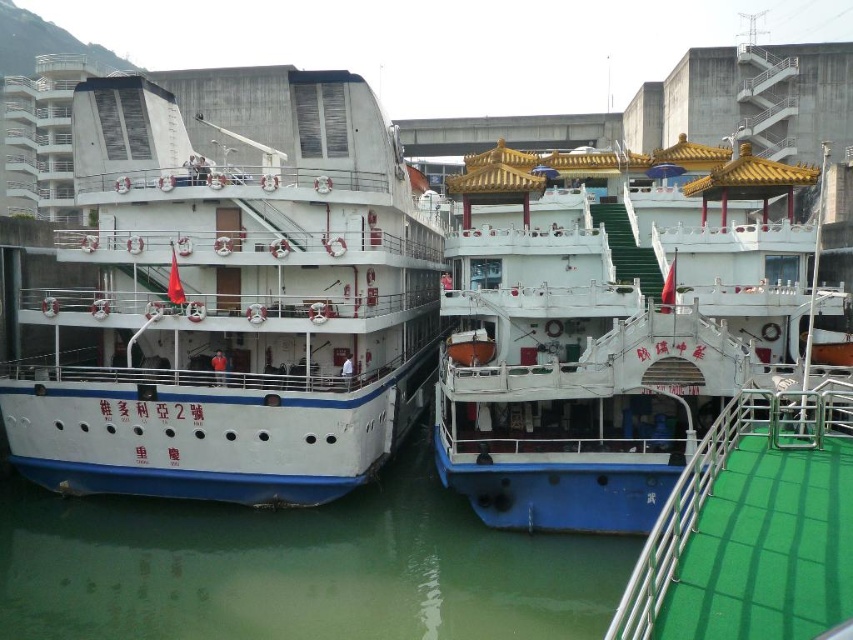
Does white matte cruise ship at left come behind white glossy boat at center?

That is True.

Find the location of a particular element. The width and height of the screenshot is (853, 640). white matte cruise ship at left is located at coordinates (231, 294).